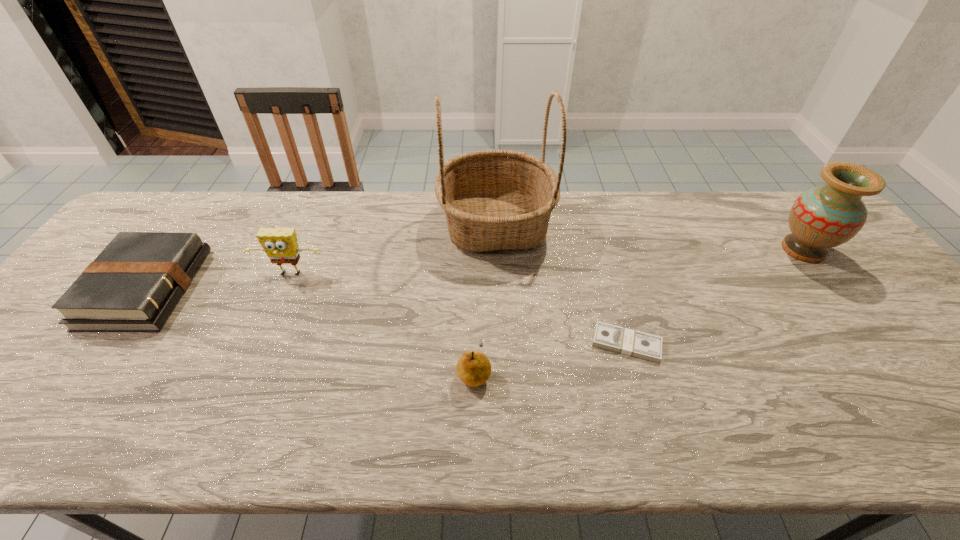
This screenshot has height=540, width=960. I want to click on free space that satisfies the following two spatial constraints: 1. on the spine side of the fifth tallest object; 2. on the back side of the pear, so click(87, 372).

This screenshot has height=540, width=960. I want to click on free space in the image that satisfies the following two spatial constraints: 1. on the face of the sponge; 2. on the spine side of the leftmost object, so click(285, 288).

At what (x,y) coordinates should I click in order to perform the action: click on vacant space that satisfies the following two spatial constraints: 1. on the face of the second object from left to right; 2. on the spine side of the hardback book. Please return your answer as a coordinate pair (x, y). Looking at the image, I should click on (285, 288).

This screenshot has width=960, height=540. I want to click on free space in the image that satisfies the following two spatial constraints: 1. on the face of the third tallest object; 2. on the spine side of the leftmost object, so click(285, 288).

At what (x,y) coordinates should I click in order to perform the action: click on vacant space that satisfies the following two spatial constraints: 1. on the face of the fourth shortest object; 2. on the left side of the shortest object. Please return your answer as a coordinate pair (x, y). Looking at the image, I should click on (262, 343).